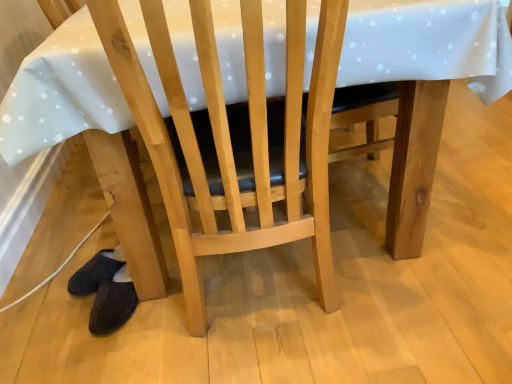
Locate an element on the screen. free space to the right of dark blue fuzzy slippers at lower left is located at coordinates (173, 309).